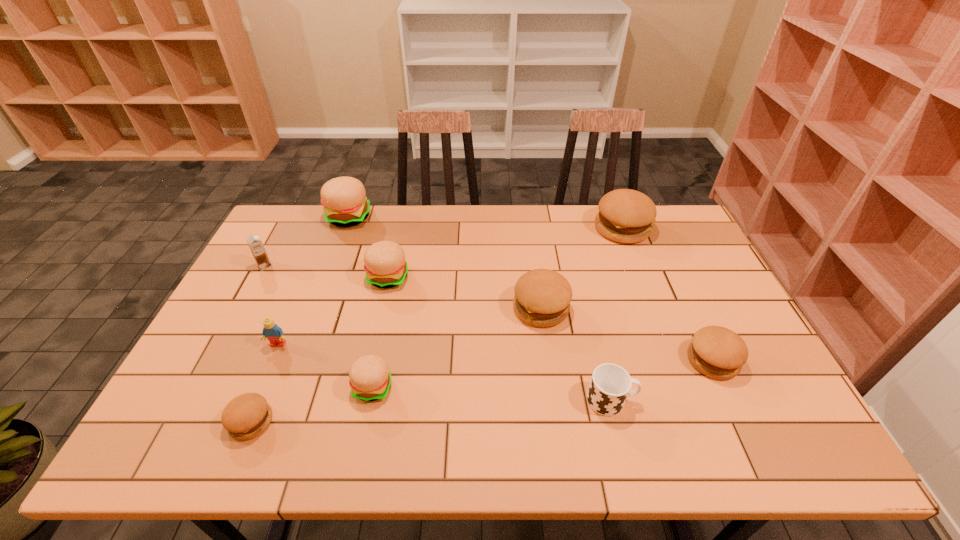
Locate an element on the screen. This screenshot has width=960, height=540. free space located 0.270m on the side of the black cup with the handle is located at coordinates (749, 400).

This screenshot has height=540, width=960. What are the coordinates of `vacant area situated on the left of the smallest beige hamburger` in the screenshot? It's located at (297, 387).

Where is `vacant space situated 0.150m on the back of the shortest hamburger`? The width and height of the screenshot is (960, 540). vacant space situated 0.150m on the back of the shortest hamburger is located at coordinates (279, 352).

Image resolution: width=960 pixels, height=540 pixels. What are the coordinates of `object located in the near edge section of the desktop` in the screenshot? It's located at click(x=246, y=416).

Locate an element on the screen. Image resolution: width=960 pixels, height=540 pixels. chocolate milk situated at the left edge is located at coordinates (256, 246).

What are the coordinates of `Lego present at the left edge` in the screenshot? It's located at (271, 331).

Where is `hamburger that is at the left edge`? The width and height of the screenshot is (960, 540). hamburger that is at the left edge is located at coordinates (246, 416).

Where is `object that is at the near left corner`? object that is at the near left corner is located at coordinates (246, 416).

The height and width of the screenshot is (540, 960). What are the coordinates of `object at the far right corner` in the screenshot? It's located at (626, 216).

The width and height of the screenshot is (960, 540). In order to click on free spot at the far edge of the desktop in this screenshot , I will do `click(371, 245)`.